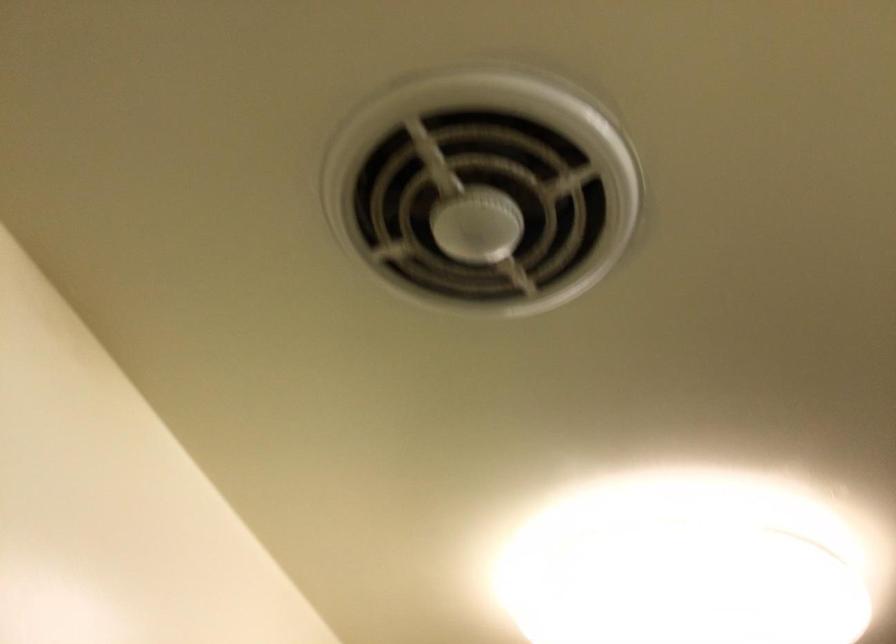
Where is `white vent knob`? white vent knob is located at coordinates (483, 192).